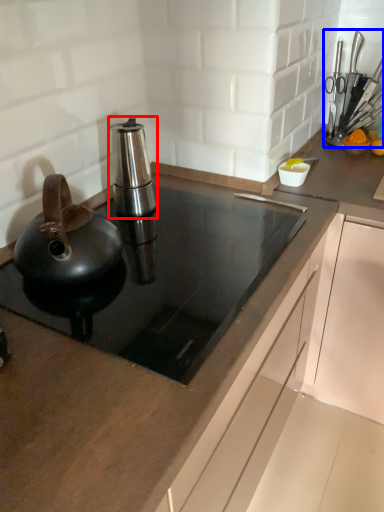
Question: Which object is closer to the camera taking this photo, kitchen appliance (highlighted by a red box) or appliance (highlighted by a blue box)?

Choices:
 (A) kitchen appliance
 (B) appliance

Answer: (A)